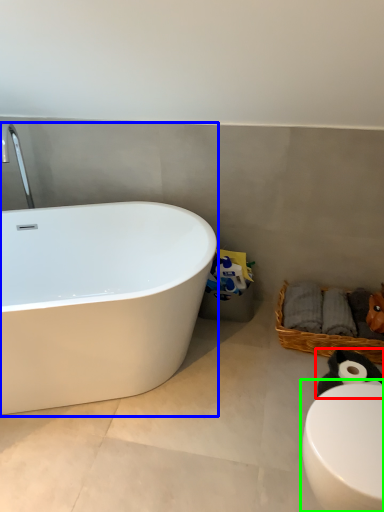
Question: Considering the real-world distances, which object is closest to animal (highlighted by a red box)? bathtub (highlighted by a blue box) or toilet (highlighted by a green box).

Choices:
 (A) bathtub
 (B) toilet

Answer: (B)